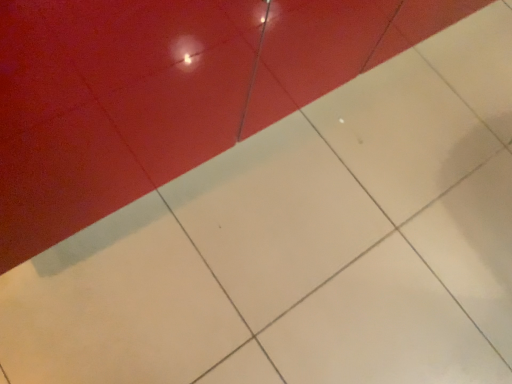
Find the location of a particular element. This screenshot has width=512, height=384. white glossy umbrella at upper left is located at coordinates (164, 92).

This screenshot has width=512, height=384. Describe the element at coordinates (164, 92) in the screenshot. I see `white glossy umbrella at upper left` at that location.

Where is `white glossy umbrella at upper left`? The width and height of the screenshot is (512, 384). white glossy umbrella at upper left is located at coordinates (164, 92).